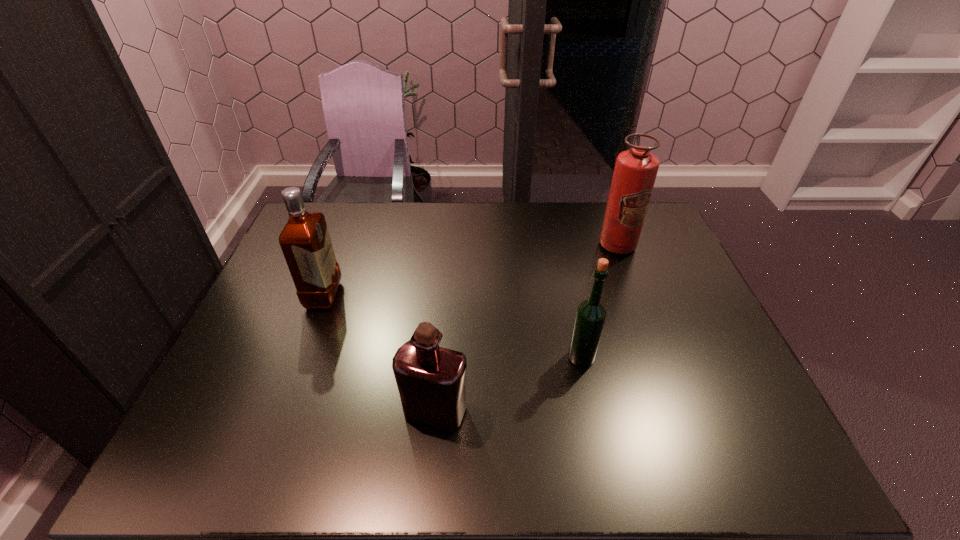
The image size is (960, 540). I want to click on vacant region located 0.260m on the front of the second object from right to left, so click(x=606, y=473).

This screenshot has width=960, height=540. What are the coordinates of `vacant region located on the right of the nearest liquor` in the screenshot? It's located at (547, 411).

The height and width of the screenshot is (540, 960). Find the location of `object at the far edge`. object at the far edge is located at coordinates point(635,171).

At what (x,y) coordinates should I click in order to perform the action: click on object at the left edge. Please return your answer as a coordinate pair (x, y). Looking at the image, I should click on (305, 241).

Where is `object that is at the right edge`? The height and width of the screenshot is (540, 960). object that is at the right edge is located at coordinates (635, 171).

At what (x,y) coordinates should I click in order to perform the action: click on object that is positioned at the far right corner. Please return your answer as a coordinate pair (x, y). The width and height of the screenshot is (960, 540). Looking at the image, I should click on [x=635, y=171].

In the image, there is a desktop. Where is `free region at the far edge`? The width and height of the screenshot is (960, 540). free region at the far edge is located at coordinates (435, 228).

Where is `blank area at the near edge`? blank area at the near edge is located at coordinates (628, 444).

This screenshot has width=960, height=540. I want to click on vacant point at the left edge, so [285, 347].

Identify the location of free space at the right edge. (674, 268).